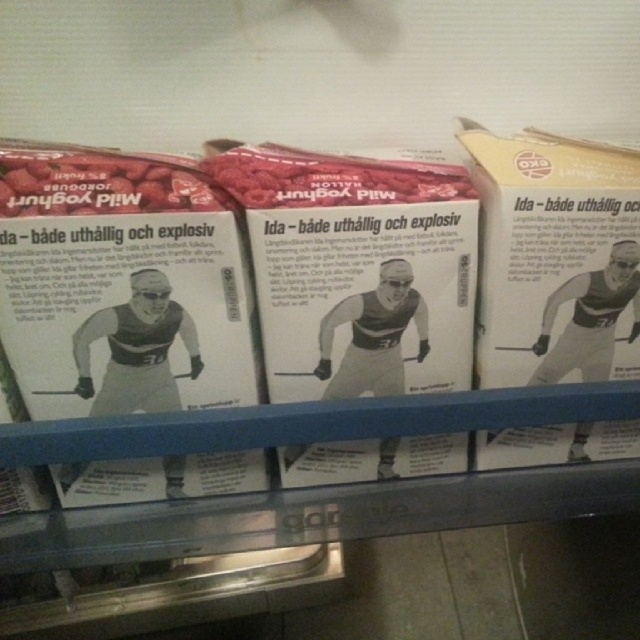
Question: Which point is closer to the camera?

Choices:
 (A) white paperboard box at right
 (B) raspberry matte at center

Answer: (B)

Question: Is raspberry matte at center to the left of matte white yogurt at left from the viewer's perspective?

Choices:
 (A) yes
 (B) no

Answer: (B)

Question: Does white paperboard box at right lie in front of matte white yogurt at left?

Choices:
 (A) yes
 (B) no

Answer: (B)

Question: Can you confirm if white paperboard box at right is positioned to the right of raspberry matte at center?

Choices:
 (A) yes
 (B) no

Answer: (A)

Question: Among these objects, which one is farthest from the camera?

Choices:
 (A) matte white yogurt at left
 (B) raspberry matte at center

Answer: (B)

Question: Which point is farther from the camera taking this photo?

Choices:
 (A) (419, 176)
 (B) (504, 282)

Answer: (A)